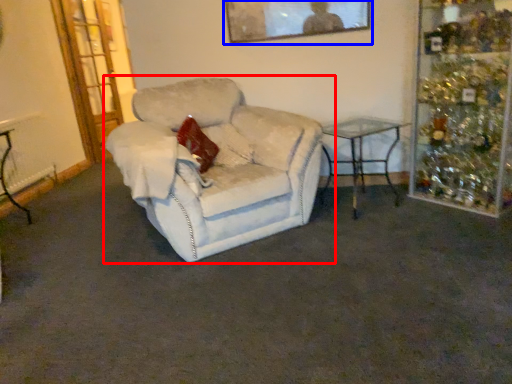
Question: Which of the following is the farthest to the observer, chair (highlighted by a red box) or picture frame (highlighted by a blue box)?

Choices:
 (A) chair
 (B) picture frame

Answer: (B)